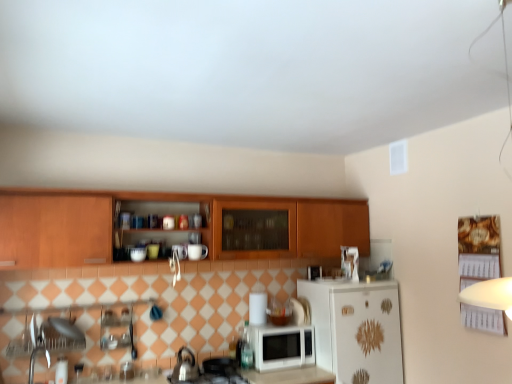
At what (x,y) coordinates should I click in order to perform the action: click on wooden cabinets at center. Please return your answer as a coordinate pair (x, y). Looking at the image, I should click on (168, 200).

The width and height of the screenshot is (512, 384). What do you see at coordinates (356, 329) in the screenshot?
I see `white matte refrigerator at lower right` at bounding box center [356, 329].

Based on the photo, measure the distance between white glossy microwave at center and camera.

The distance of white glossy microwave at center from camera is 3.36 meters.

What is the approximate height of white matte microwave at center?

11.29 inches.

Image resolution: width=512 pixels, height=384 pixels. In order to click on wooden cabinets at center in this screenshot , I will do `click(168, 200)`.

Choose the correct answer: Is white matte refrigerator at lower right inside wooden cabinets at center or outside it?

white matte refrigerator at lower right is outside wooden cabinets at center.

Is white matte refrigerator at lower right taller or shorter than wooden cabinets at center?

In the image, white matte refrigerator at lower right appears to be taller than wooden cabinets at center.

Can you tell me how much white matte refrigerator at lower right and wooden cabinets at center differ in facing direction?

There is a 0.000129-degree angle between the facing directions of white matte refrigerator at lower right and wooden cabinets at center.

From a real-world perspective, which is physically above, white glossy microwave at center or brushed metal tea pot at lower center?

In real-world perspective, white glossy microwave at center is above.

Does white glossy microwave at center have a greater height compared to brushed metal tea pot at lower center?

No, white glossy microwave at center is not taller than brushed metal tea pot at lower center.

Choose the correct answer: Is white glossy microwave at center inside brushed metal tea pot at lower center or outside it?

white glossy microwave at center is outside brushed metal tea pot at lower center.

From the image's perspective, is wooden cabinets at center located above or below white glossy microwave at center?

From the image's perspective, wooden cabinets at center appears above white glossy microwave at center.

Does wooden cabinets at center have a greater width compared to white glossy microwave at center?

Indeed, wooden cabinets at center has a greater width compared to white glossy microwave at center.

Does point (323, 238) come behind point (321, 266)?

Yes, it is.

Is white matte refrigerator at lower right far from white glossy microwave at center?

They are positioned close to each other.

Considering the sizes of white matte refrigerator at lower right and white glossy microwave at center in the image, is white matte refrigerator at lower right bigger or smaller than white glossy microwave at center?

Clearly, white matte refrigerator at lower right is larger in size than white glossy microwave at center.

From the picture: Which object is closer to the camera taking this photo, white matte refrigerator at lower right or white glossy microwave at center?

Positioned in front is white matte refrigerator at lower right.

Is white matte microwave at center to the left or to the right of brushed metal tea pot at lower center in the image?

white matte microwave at center is positioned on brushed metal tea pot at lower center's right side.

Is white matte microwave at center positioned beyond the bounds of brushed metal tea pot at lower center?

Yes, white matte microwave at center is outside of brushed metal tea pot at lower center.

Does point (267, 351) appear closer or farther from the camera than point (188, 373)?

Point (267, 351) is farther from the camera than point (188, 373).

Is white matte microwave at center closer to the viewer compared to brushed metal tea pot at lower center?

No, white matte microwave at center is further to the viewer.

From a real-world perspective, which object stands above the other?

wooden cabinets at center.

This screenshot has height=384, width=512. I want to click on cabinetry above the white matte microwave at center (from a real-world perspective), so click(x=168, y=200).

Is wooden cabinets at center completely or partially inside white matte microwave at center?

No.

How distant is white matte refrigerator at lower right from white matte microwave at center?

They are 13.11 inches apart.

Is white matte refrigerator at lower right touching white matte microwave at center?

No, white matte refrigerator at lower right is not making contact with white matte microwave at center.

Is white matte refrigerator at lower right behind white matte microwave at center?

No, white matte refrigerator at lower right is closer to the viewer.

Identify the location of refrigerator that appears behind the wooden cabinets at center. (356, 329).

Identify the location of tea pot in front of the white glossy microwave at center. (185, 366).

Looking at the image, which one is located closer to wooden cabinets at center, brushed metal tea pot at lower center or white matte microwave at center?

white matte microwave at center is closer to wooden cabinets at center.

Looking at this image, looking at the image, which one is located closer to brushed metal tea pot at lower center, white matte refrigerator at lower right or wooden cabinets at center?

wooden cabinets at center lies closer to brushed metal tea pot at lower center than the other object.

When comparing their distances from brushed metal tea pot at lower center, does white matte refrigerator at lower right or white glossy microwave at center seem closer?

Based on the image, white glossy microwave at center appears to be nearer to brushed metal tea pot at lower center.

When comparing their distances from white matte refrigerator at lower right, does brushed metal tea pot at lower center or wooden cabinets at center seem further?

Based on the image, brushed metal tea pot at lower center appears to be further to white matte refrigerator at lower right.

Considering their positions, is white matte refrigerator at lower right positioned closer to white matte microwave at center than white glossy microwave at center?

Based on the image, white matte refrigerator at lower right appears to be nearer to white matte microwave at center.

Based on the photo, considering their positions, is brushed metal tea pot at lower center positioned further to white matte refrigerator at lower right than white glossy microwave at center?

Based on the image, brushed metal tea pot at lower center appears to be further to white matte refrigerator at lower right.

Looking at the image, which one is located closer to wooden cabinets at center, white matte refrigerator at lower right or white matte microwave at center?

Based on the image, white matte refrigerator at lower right appears to be nearer to wooden cabinets at center.

Looking at this image, which object lies nearer to the anchor point white matte refrigerator at lower right, brushed metal tea pot at lower center or white matte microwave at center?

white matte microwave at center is positioned closer to the anchor white matte refrigerator at lower right.

The width and height of the screenshot is (512, 384). I want to click on appliance situated between wooden cabinets at center and white matte refrigerator at lower right from left to right, so pyautogui.click(x=314, y=272).

I want to click on cabinetry between brushed metal tea pot at lower center and white matte refrigerator at lower right, so click(x=168, y=200).

Locate an element on the screen. This screenshot has height=384, width=512. microwave oven between brushed metal tea pot at lower center and white matte refrigerator at lower right from left to right is located at coordinates (281, 346).

Where is `microwave oven situated between brushed metal tea pot at lower center and white glossy microwave at center from left to right`? The height and width of the screenshot is (384, 512). microwave oven situated between brushed metal tea pot at lower center and white glossy microwave at center from left to right is located at coordinates [x=281, y=346].